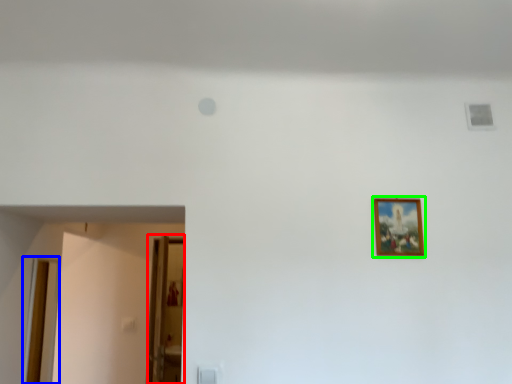
Question: Which object is positioned closest to glass door (highlighted by a red box)? Select from door (highlighted by a blue box) and picture frame (highlighted by a green box).

Choices:
 (A) door
 (B) picture frame

Answer: (A)